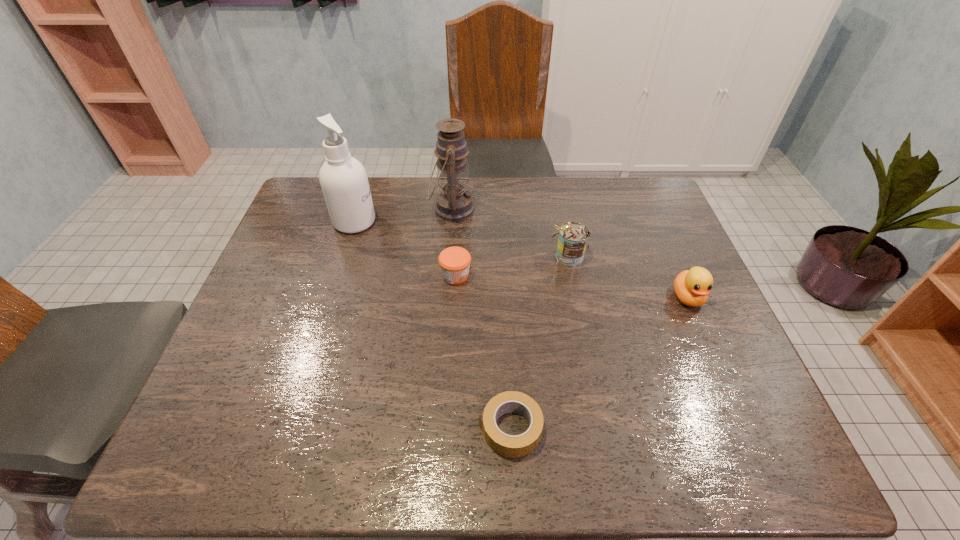
This screenshot has height=540, width=960. What are the coordinates of `vacant area situated on the left of the oil lamp` in the screenshot? It's located at (392, 209).

The height and width of the screenshot is (540, 960). In order to click on vacant space located on the back of the can in this screenshot , I will do `click(557, 199)`.

Where is `vacant region located on the face of the third shortest object`? vacant region located on the face of the third shortest object is located at coordinates (730, 395).

Where is `free location located 0.320m on the front label of the jam`? This screenshot has width=960, height=540. free location located 0.320m on the front label of the jam is located at coordinates (592, 275).

At what (x,y) coordinates should I click in order to perform the action: click on free space located 0.300m at the edge of the third object from right to left. Please return your answer as a coordinate pair (x, y). The width and height of the screenshot is (960, 540). Looking at the image, I should click on (328, 429).

Locate an element on the screen. The width and height of the screenshot is (960, 540). blank area located at the edge of the third object from right to left is located at coordinates (293, 429).

The width and height of the screenshot is (960, 540). Find the location of `free spot located at the edge of the third object from right to left`. free spot located at the edge of the third object from right to left is located at coordinates click(323, 429).

This screenshot has height=540, width=960. What are the coordinates of `cleansing agent that is at the far edge` in the screenshot? It's located at (343, 179).

Where is `oil lamp present at the far edge`? The width and height of the screenshot is (960, 540). oil lamp present at the far edge is located at coordinates (454, 203).

Where is `object positioned at the near edge`? This screenshot has height=540, width=960. object positioned at the near edge is located at coordinates (506, 445).